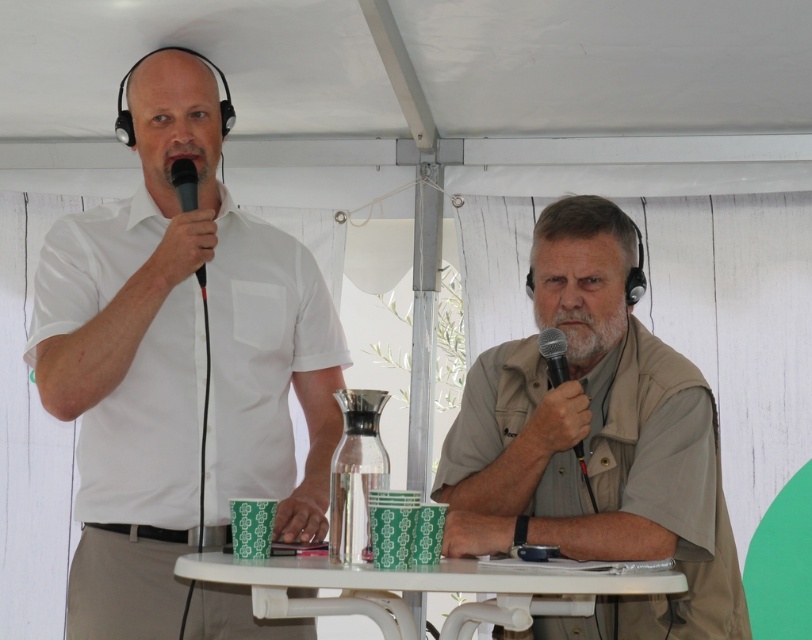
You are a photographer setting up for an event. You notice the white matte shirt at left and the black matte microphone at center in the scene. From the photographer perspective, which object is positioned higher?

The white matte shirt at left is above the black matte microphone at center, so it is positioned higher.

You are organizing a small event and need to know the arrangement of items on the table. Are the beige fabric vest at center and the black matte microphone at center placed in a way that the vest is closer to the speaker on the left compared to the microphone?

The beige fabric vest at center is in front of the black matte microphone at center, meaning it is closer to the speaker on the left than the microphone.